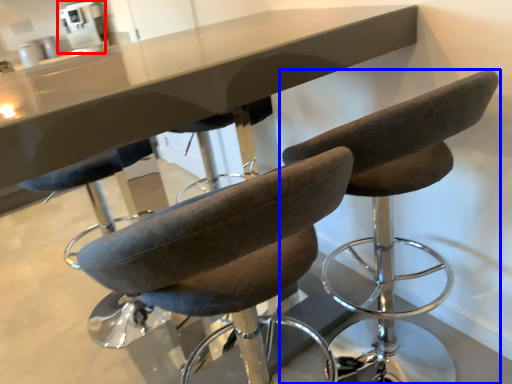
Question: Among these objects, which one is farthest to the camera, coffee machine (highlighted by a red box) or chair (highlighted by a blue box)?

Choices:
 (A) coffee machine
 (B) chair

Answer: (A)